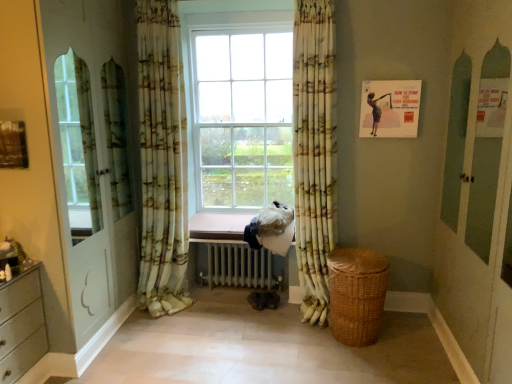
Question: Is yellow-green floral fabric curtain at center, positioned as the 1th curtain in right-to-left order, with pink wood at center?

Choices:
 (A) yes
 (B) no

Answer: (B)

Question: Is pink wood at center a part of yellow-green floral fabric curtain at center, the second curtain when ordered from left to right?

Choices:
 (A) yes
 (B) no

Answer: (B)

Question: Can you confirm if yellow-green floral fabric curtain at center, positioned as the 1th curtain in right-to-left order, is shorter than pink wood at center?

Choices:
 (A) no
 (B) yes

Answer: (A)

Question: From a real-world perspective, is yellow-green floral fabric curtain at center, the second curtain when ordered from left to right, on top of pink wood at center?

Choices:
 (A) yes
 (B) no

Answer: (A)

Question: Is yellow-green floral fabric curtain at center, positioned as the 1th curtain in right-to-left order, located outside pink wood at center?

Choices:
 (A) yes
 (B) no

Answer: (A)

Question: Looking at the image, does printed fabric curtain at left, the 1th curtain in the left-to-right sequence, seem bigger or smaller compared to yellow-green floral fabric curtain at center, the second curtain when ordered from left to right?

Choices:
 (A) small
 (B) big

Answer: (B)

Question: In terms of height, does printed fabric curtain at left, the second curtain when ordered from right to left, look taller or shorter compared to yellow-green floral fabric curtain at center, positioned as the 1th curtain in right-to-left order?

Choices:
 (A) tall
 (B) short

Answer: (A)

Question: From the image's perspective, is printed fabric curtain at left, the second curtain when ordered from right to left, located above or below yellow-green floral fabric curtain at center, the second curtain when ordered from left to right?

Choices:
 (A) above
 (B) below

Answer: (A)

Question: Does point (146, 14) appear closer or farther from the camera than point (318, 36)?

Choices:
 (A) closer
 (B) farther

Answer: (B)

Question: In the image, is woven brown basket at lower right positioned in front of or behind pink wood at center?

Choices:
 (A) behind
 (B) front

Answer: (B)

Question: From the image's perspective, is woven brown basket at lower right positioned above or below pink wood at center?

Choices:
 (A) below
 (B) above

Answer: (A)

Question: Is woven brown basket at lower right to the left or to the right of pink wood at center in the image?

Choices:
 (A) right
 (B) left

Answer: (A)

Question: Is woven brown basket at lower right bigger or smaller than pink wood at center?

Choices:
 (A) small
 (B) big

Answer: (B)

Question: From the image's perspective, is yellow-green floral fabric curtain at center, the second curtain when ordered from left to right, above or below white metallic radiator at center?

Choices:
 (A) below
 (B) above

Answer: (B)

Question: From a real-world perspective, is yellow-green floral fabric curtain at center, the second curtain when ordered from left to right, above or below white metallic radiator at center?

Choices:
 (A) below
 (B) above

Answer: (B)